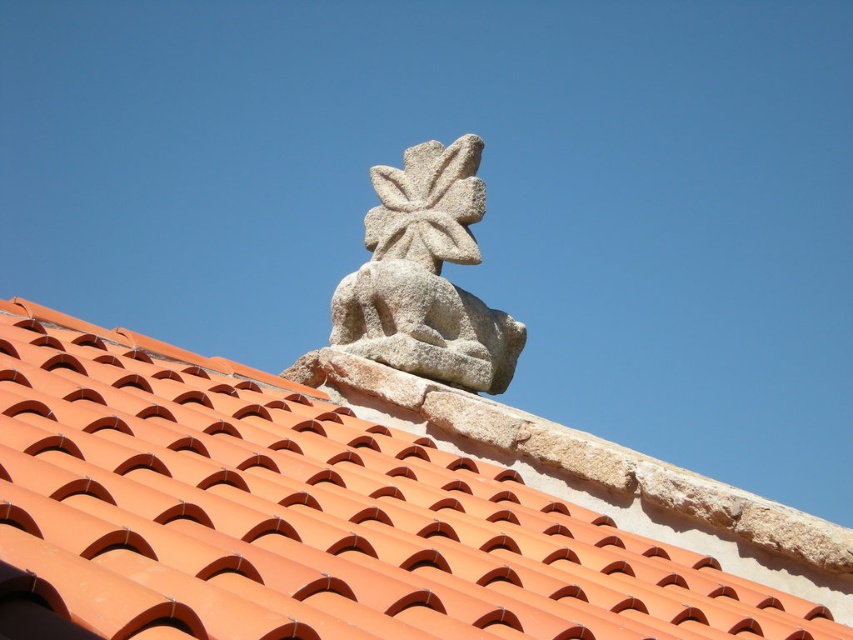
Is point (471, 625) positioned in front of point (340, 326)?

Yes, point (471, 625) is closer to viewer.

Can you confirm if orange clay tiles at upper center is smaller than granite statue at upper center?

No, orange clay tiles at upper center is not smaller than granite statue at upper center.

I want to click on orange clay tiles at upper center, so click(302, 516).